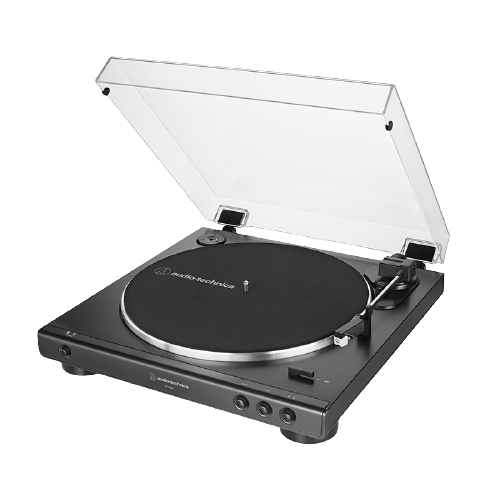
Where is `record player`? The image size is (500, 500). record player is located at coordinates (353, 369).